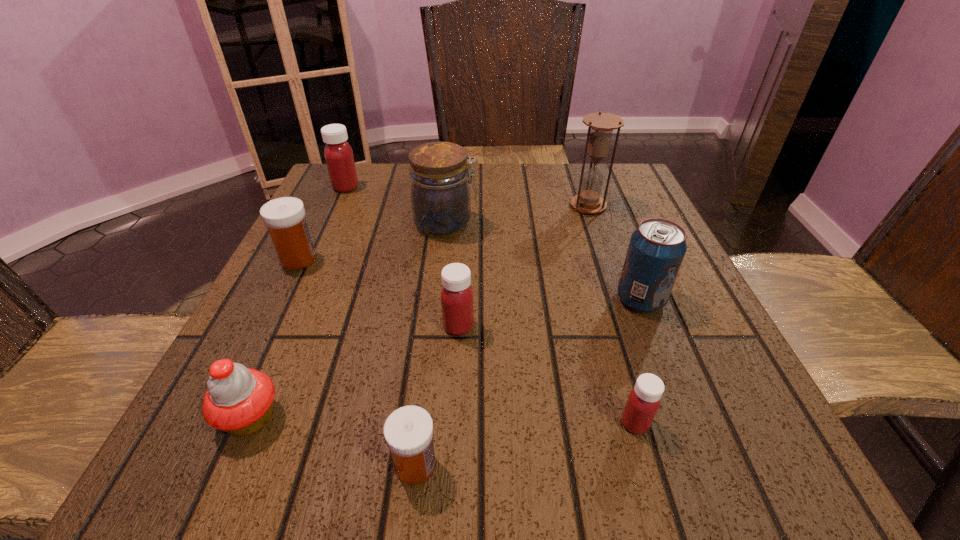
At what (x,y) coordinates should I click in order to perform the action: click on free space located on the right of the third farthest medicine. Please return your answer as a coordinate pair (x, y). Image resolution: width=960 pixels, height=540 pixels. Looking at the image, I should click on (551, 326).

The width and height of the screenshot is (960, 540). What are the coordinates of `vacant space located 0.310m on the back of the red cupcake` in the screenshot? It's located at (321, 258).

At what (x,y) coordinates should I click in order to perform the action: click on free space located on the left of the rightmost medicine. Please return your answer as a coordinate pair (x, y). Looking at the image, I should click on (343, 423).

Locate an element on the screen. The height and width of the screenshot is (540, 960). free space located 0.300m on the right of the right white medicine is located at coordinates (674, 465).

The width and height of the screenshot is (960, 540). I want to click on hourglass present at the far edge, so click(601, 125).

The height and width of the screenshot is (540, 960). I want to click on jar that is positioned at the far edge, so click(440, 197).

Where is `medicine that is at the far edge`? The height and width of the screenshot is (540, 960). medicine that is at the far edge is located at coordinates (338, 154).

The height and width of the screenshot is (540, 960). Identify the location of cupcake situated at the near edge. (239, 400).

You are a GUI agent. You are given a task and a screenshot of the screen. Output one action in this format:
    pyautogui.click(x=<x>, y=<y>)
    Task: Click on the cupcake that is at the left edge
    This screenshot has height=540, width=960.
    Given the screenshot: What is the action you would take?
    pyautogui.click(x=239, y=400)

Find the location of `hourglass that is positioned at the right edge`. hourglass that is positioned at the right edge is located at coordinates (601, 125).